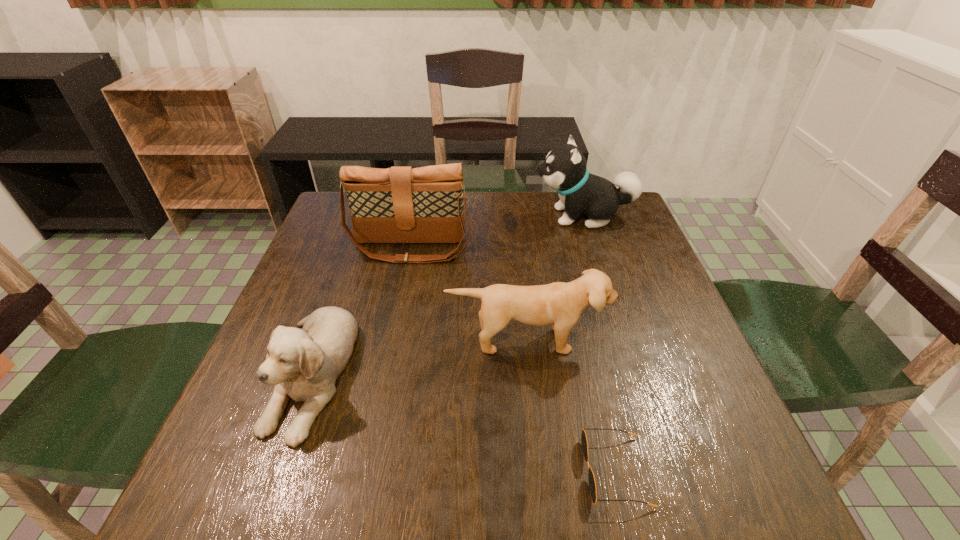
The image size is (960, 540). I want to click on object situated at the far right corner, so [565, 170].

In the image, there is a desktop. Where is `free region at the far edge`? The image size is (960, 540). free region at the far edge is located at coordinates (551, 208).

Find the location of a particular element. The height and width of the screenshot is (540, 960). vacant space at the near edge of the desktop is located at coordinates (450, 498).

What are the coordinates of `vacant space at the left edge of the desktop` in the screenshot? It's located at (227, 449).

In the image, there is a desktop. Where is `blank space at the right edge`? Image resolution: width=960 pixels, height=540 pixels. blank space at the right edge is located at coordinates (630, 273).

Locate an element on the screen. Image resolution: width=960 pixels, height=540 pixels. vacant space at the far left corner of the desktop is located at coordinates (326, 223).

Identify the location of vacant space at the far right corner. (627, 207).

Find the location of a particular element. This screenshot has height=540, width=960. free space between the fourth nearest object and the farthest puppy is located at coordinates click(x=497, y=232).

At what (x,y) coordinates should I click in order to perform the action: click on empty space that is in between the leftmost puppy and the farthest object. Please return your answer as a coordinate pair (x, y). The image size is (960, 540). Looking at the image, I should click on (447, 294).

Find the location of a particular element. vacant area that lies between the second farthest object and the leftmost puppy is located at coordinates (361, 310).